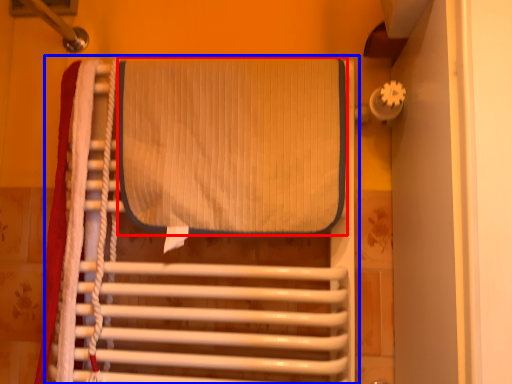
Question: Among these objects, which one is farthest to the camera, wide (highlighted by a red box) or furniture (highlighted by a blue box)?

Choices:
 (A) wide
 (B) furniture

Answer: (A)